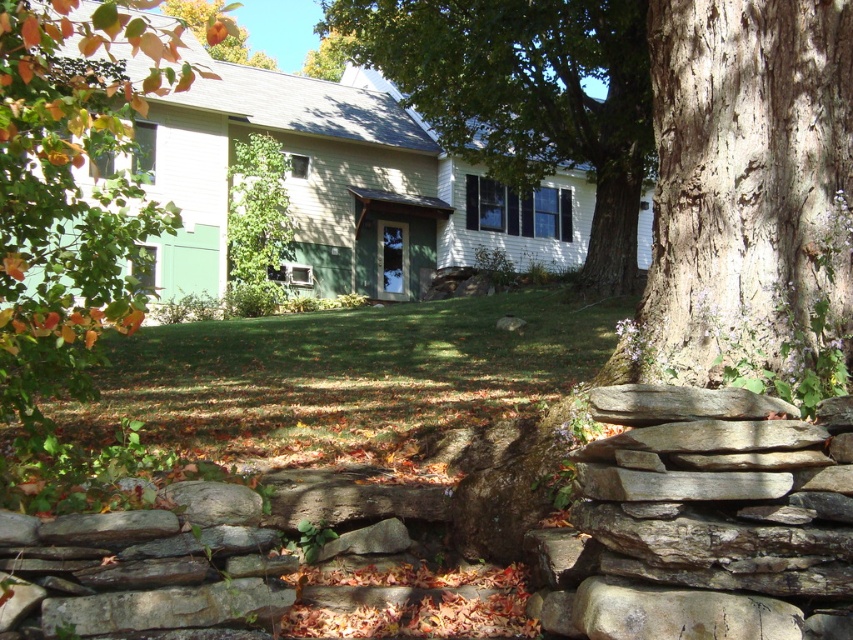
Can you confirm if green textured tree at center is bigger than green leafy tree at center?

Yes.

Can you confirm if green textured tree at center is taller than green leafy tree at center?

Correct, green textured tree at center is much taller as green leafy tree at center.

Who is more distant from viewer, (476,72) or (270,259)?

The point (270,259) is behind.

Locate an element on the screen. This screenshot has height=640, width=853. green textured tree at center is located at coordinates (527, 97).

Is green leafy tree at left above green leafy tree at center?

No, green leafy tree at left is not above green leafy tree at center.

Can you confirm if green leafy tree at left is wider than green leafy tree at center?

Yes.

This screenshot has height=640, width=853. In order to click on green leafy tree at left in this screenshot , I will do `click(71, 192)`.

At what (x,y) coordinates should I click in order to perform the action: click on green leafy tree at left. Please return your answer as a coordinate pair (x, y). Looking at the image, I should click on click(71, 192).

Who is more forward, (277,243) or (320,76)?

Point (277,243) is more forward.

Is point (260, 204) in front of point (345, 38)?

Yes, point (260, 204) is closer to viewer.

Does point (285, 221) come closer to viewer compared to point (311, 65)?

Yes, point (285, 221) is in front of point (311, 65).

Identify the location of green leafy tree at center. The image size is (853, 640). (256, 227).